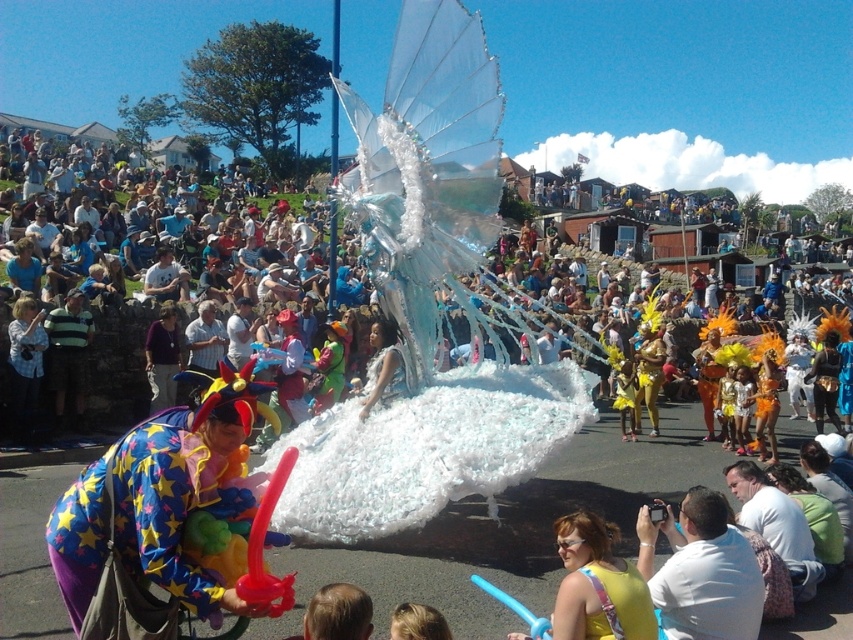
Question: Which of the following is the farthest from the observer?

Choices:
 (A) rubber clown toy at lower left
 (B) white matte balloon at center

Answer: (B)

Question: Does rubber clown toy at lower left have a greater width compared to white matte balloon at center?

Choices:
 (A) yes
 (B) no

Answer: (A)

Question: Which point is farther from the camera taking this photo?

Choices:
 (A) (717, 497)
 (B) (155, 465)

Answer: (A)

Question: Does rubber clown toy at lower left appear over white matte balloon at center?

Choices:
 (A) no
 (B) yes

Answer: (B)

Question: Is rubber clown toy at lower left thinner than white matte balloon at center?

Choices:
 (A) yes
 (B) no

Answer: (B)